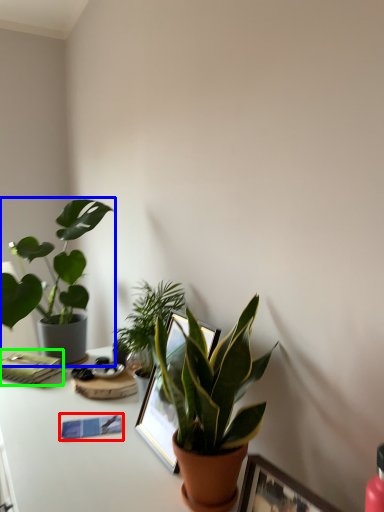
Question: Which object is the farthest from journal (highlighted by a red box)? Choose among these: houseplant (highlighted by a blue box) or paperback book (highlighted by a green box).

Choices:
 (A) houseplant
 (B) paperback book

Answer: (A)